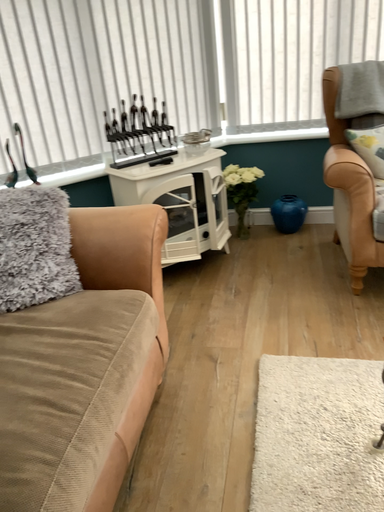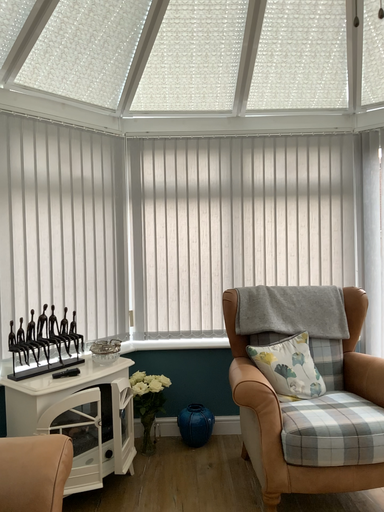
Question: How did the camera likely rotate when shooting the video?

Choices:
 (A) rotated left
 (B) rotated right

Answer: (B)